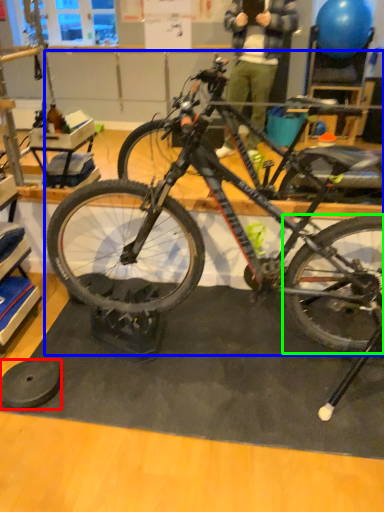
Question: Considering the real-world distances, which object is closest to wheel (highlighted by a red box)? bicycle (highlighted by a blue box) or bicycle wheel (highlighted by a green box).

Choices:
 (A) bicycle
 (B) bicycle wheel

Answer: (A)